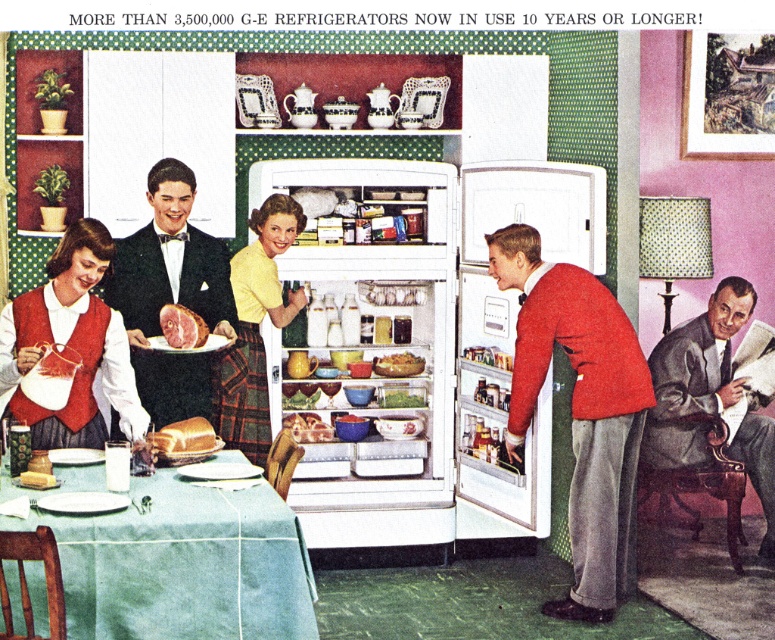
Between yellow fabric skirt at center and brown leather stool at lower right, which one has less height?

Standing shorter between the two is brown leather stool at lower right.

Is yellow fabric skirt at center positioned before brown leather stool at lower right?

Yes, yellow fabric skirt at center is closer to the viewer.

Does point (262, 257) come farther from viewer compared to point (679, 483)?

No, (262, 257) is closer to viewer.

You are a GUI agent. You are given a task and a screenshot of the screen. Output one action in this format:
    pyautogui.click(x=<x>, y=<y>)
    Task: Click on the yellow fabric skirt at center
    The height and width of the screenshot is (640, 775).
    Given the screenshot: What is the action you would take?
    tap(253, 328)

Who is more distant from viewer, (689, 115) or (181, 435)?

The point (689, 115) is more distant.

Image resolution: width=775 pixels, height=640 pixels. What are the coordinates of `wooden framed picture at upper right` in the screenshot? It's located at (727, 97).

Which is in front, point (684, 72) or point (169, 428)?

Point (169, 428) is in front.

Locate an element on the screen. The width and height of the screenshot is (775, 640). wooden framed picture at upper right is located at coordinates (x=727, y=97).

Which is more to the left, white glossy refrigerator at center or smooth gray suit at right?

white glossy refrigerator at center

Between point (539, 221) and point (693, 380), which one is positioned in front?

Point (539, 221)

Where is `white glossy refrigerator at center`? white glossy refrigerator at center is located at coordinates coord(419,344).